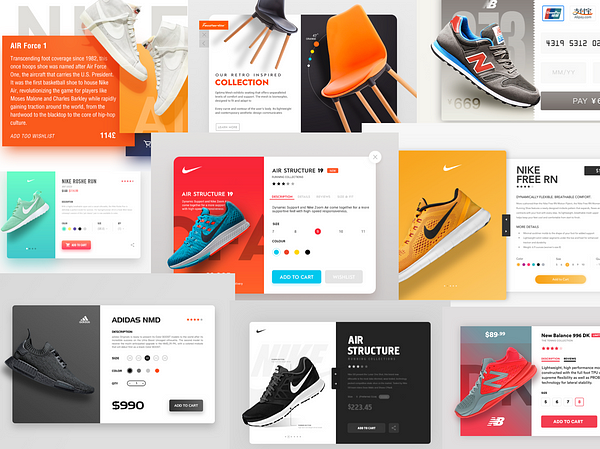
Locate an element on the screen. The width and height of the screenshot is (600, 449). chair legs on orange chair is located at coordinates (340, 105), (366, 104), (384, 104), (401, 79).